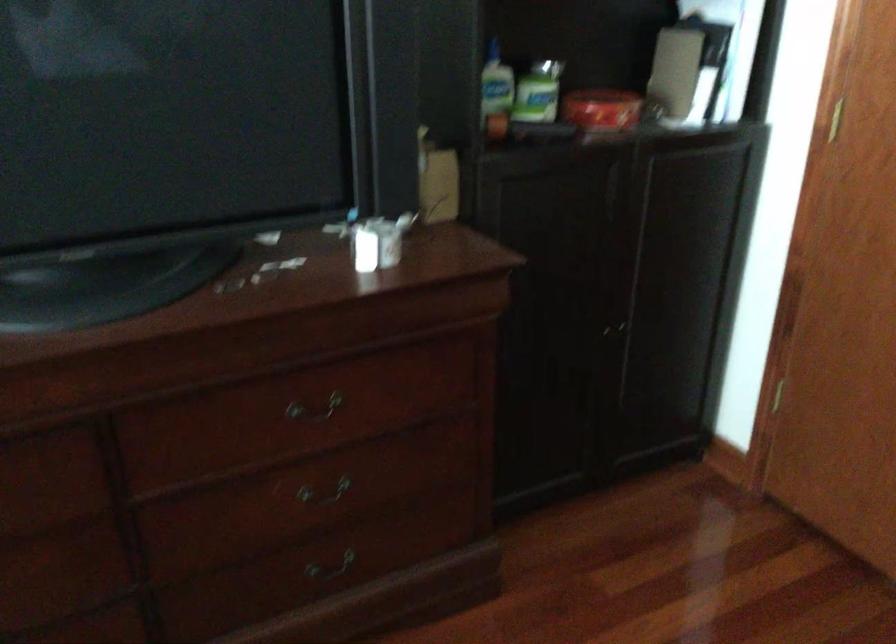
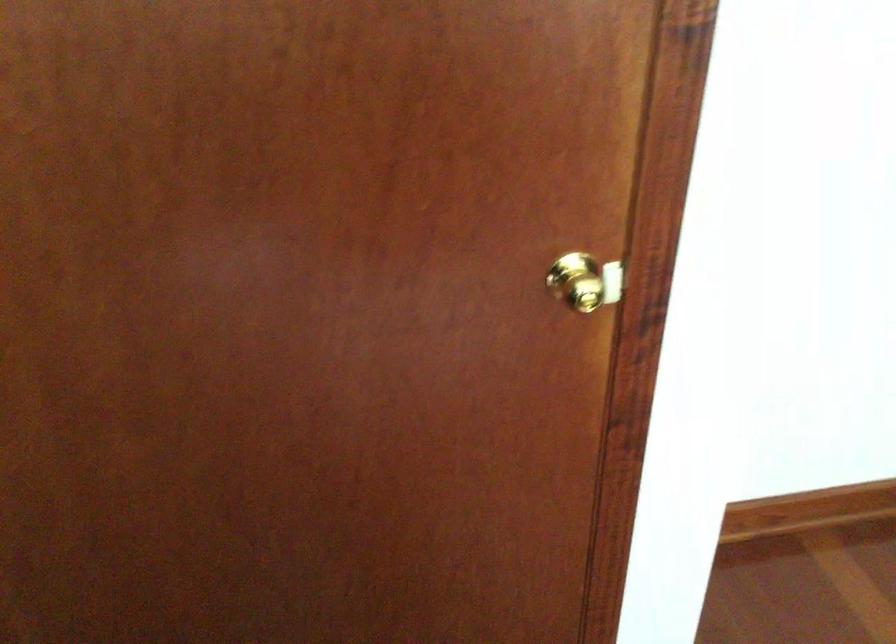
The first image is from the beginning of the video and the second image is from the end. How did the camera likely rotate when shooting the video?

The camera rotated toward right-down.